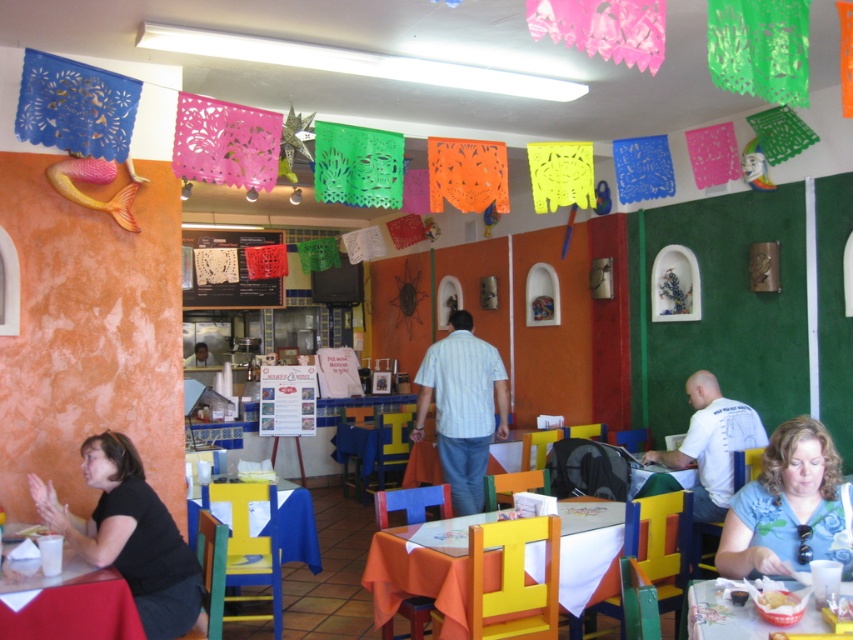
Question: Estimate the real-world distances between objects in this image. Which object is farther from the matte black shirt at center?

Choices:
 (A) matte plastic bowl at lower right
 (B) orange fabric table at center
 (C) light blue striped shirt at center

Answer: (A)

Question: Which object is the closest to the orange fabric table at center?

Choices:
 (A) matte black shirt at center
 (B) wooden table at center

Answer: (B)

Question: Which object is the farthest from the matte black shirt at center?

Choices:
 (A) matte plastic bowl at lower right
 (B) white creamy food at lower right

Answer: (B)

Question: Does wooden table at center appear on the right side of white cotton shirt at lower right?

Choices:
 (A) yes
 (B) no

Answer: (B)

Question: Is white lace menu at center closer to camera compared to matte black shirt at center?

Choices:
 (A) no
 (B) yes

Answer: (B)

Question: Can you confirm if black fabric shirt at lower left is positioned below white cotton shirt at lower right?

Choices:
 (A) no
 (B) yes

Answer: (B)